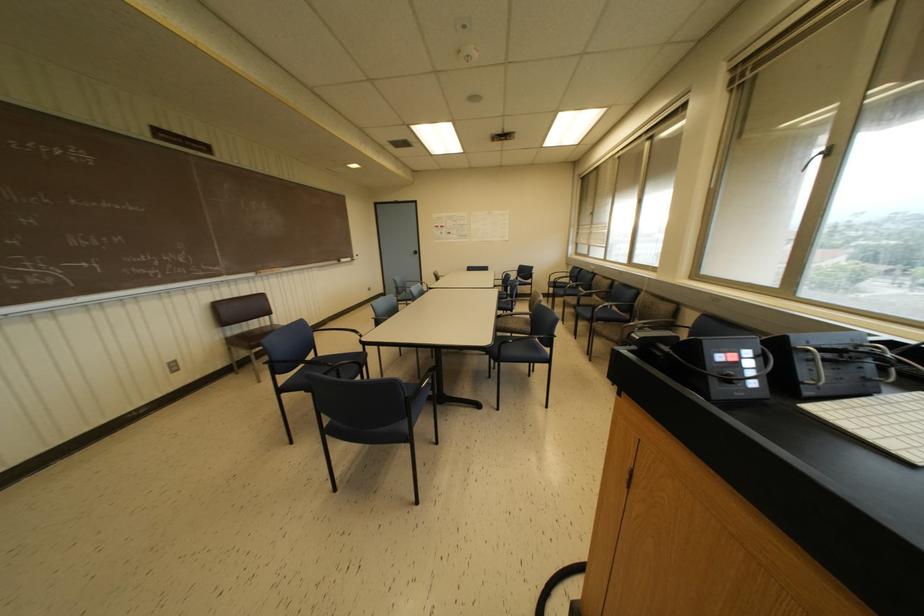
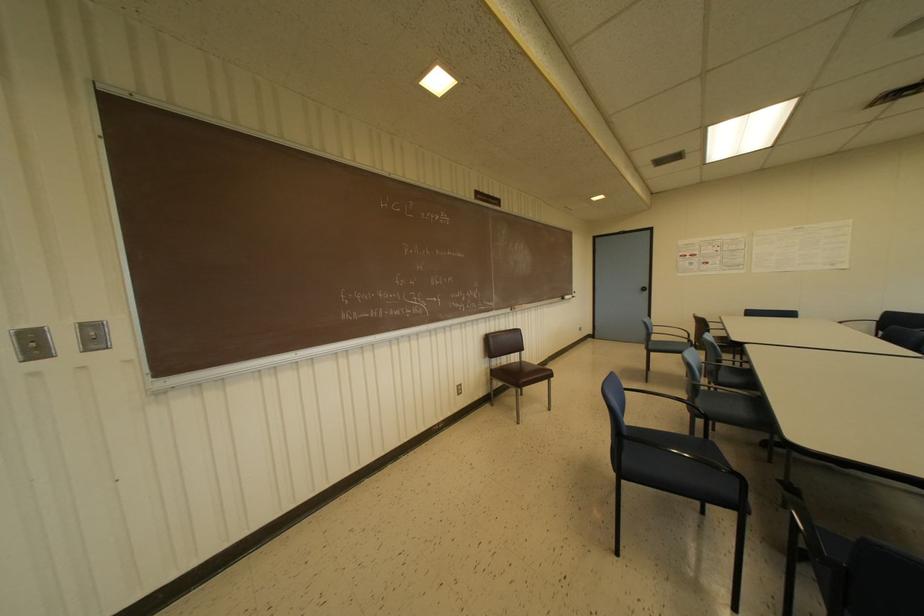
Locate, in the second image, the point that corresponds to the point at 417,252 in the first image.

(646, 288)